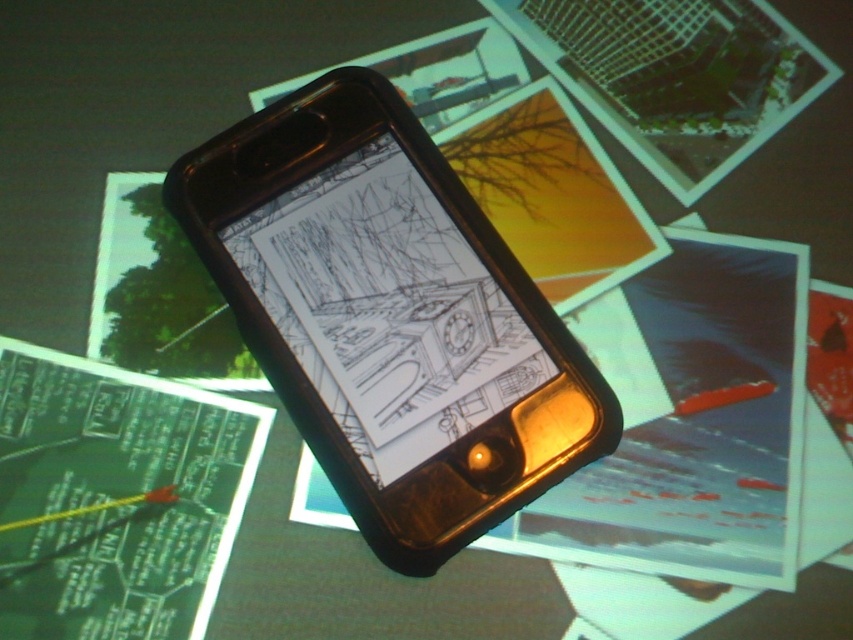
You are an interior designer who needs to place a 7.5 inch ruler between the black plastic smartphone at center and the matte yellow paper at center. Based on the scene, will the ruler fit between them without overlapping either object?

The black plastic smartphone at center is 7.21 inches away from the matte yellow paper at center. Since the ruler is 7.5 inches long, it will not fit between them without overlapping because the distance is shorter than the ruler.

You are organizing a collage and need to place the matte yellow paper at center and the green paper at center. Which paper should you place first if you want the wider one to be visible underneath?

The matte yellow paper at center might be wider than green paper at center, so you should place the green paper at center first to ensure the wider matte yellow paper at center is visible underneath.

You are organizing a display and need to know the arrangement of items on the surface. Which object is placed on top of the other between the black plastic smartphone at center and the matte yellow paper at center?

The black plastic smartphone at center is positioned over matte yellow paper at center, so the smartphone is on top of the matte yellow paper at center.